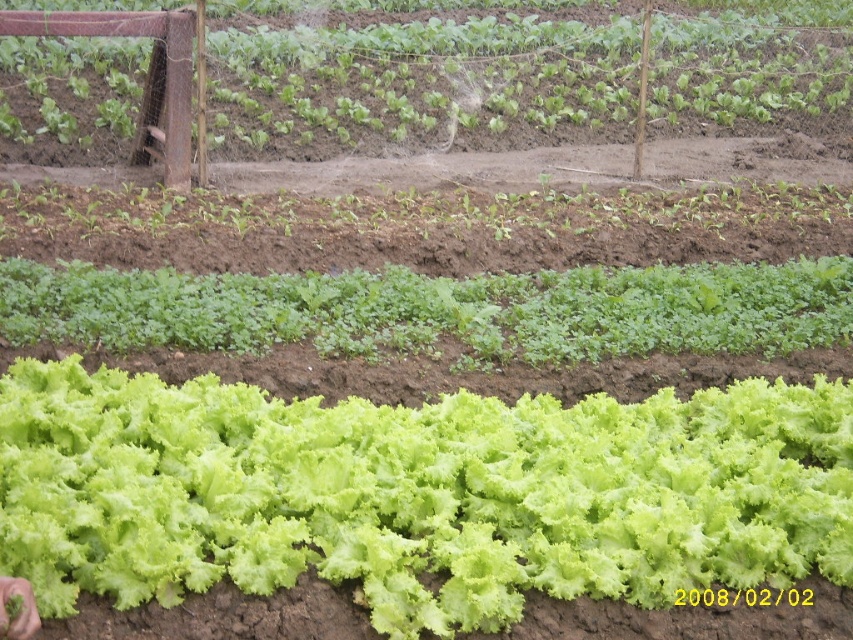
Who is more forward, (479,67) or (218,349)?

Positioned in front is point (218,349).

Who is shorter, green leafy lettuce at upper center or green leafy at center?

Standing shorter between the two is green leafy at center.

Which is in front, point (741, 93) or point (378, 276)?

Point (378, 276) is more forward.

Identify the location of green leafy lettuce at upper center. (416, 74).

Is green leafy at center thinner than green leafy plant at center?

In fact, green leafy at center might be wider than green leafy plant at center.

Which is more to the left, green leafy at center or green leafy plant at center?

green leafy plant at center is more to the left.

Between point (49, 308) and point (88, 227), which one is positioned in front?

Point (49, 308) is in front.

Find the location of a particular element. This screenshot has width=853, height=640. green leafy at center is located at coordinates (437, 308).

Does green leafy lettuce at lower center have a lesser height compared to green leafy lettuce at upper center?

Indeed, green leafy lettuce at lower center has a lesser height compared to green leafy lettuce at upper center.

Does point (584, 582) come farther from viewer compared to point (506, 93)?

No.

Is point (149, 472) positioned after point (229, 147)?

That is False.

Find the location of `green leafy lettuce at lower center`. green leafy lettuce at lower center is located at coordinates (416, 493).